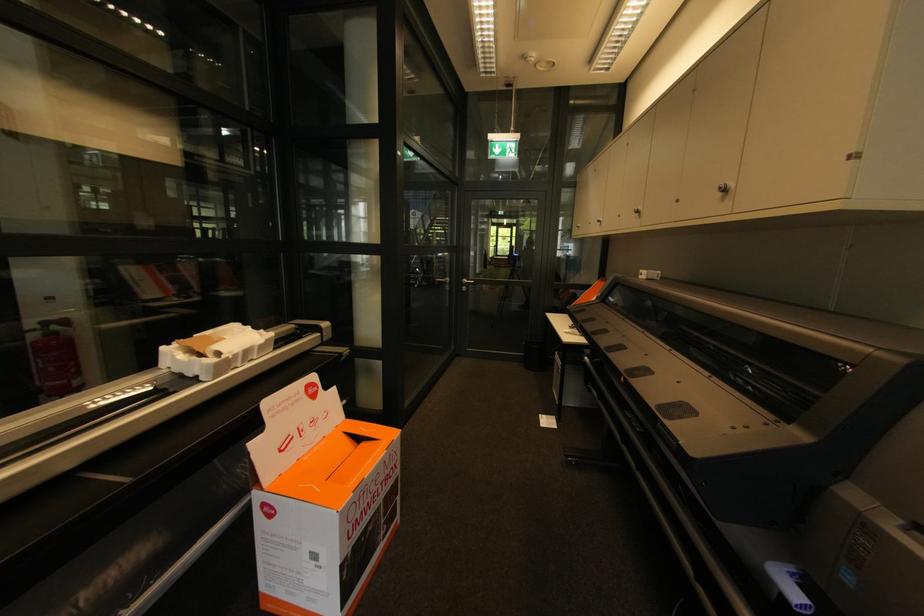
Find where to lift the white styrofoam packaging. Please return your answer as a coordinate pair (x, y).

(214, 351)